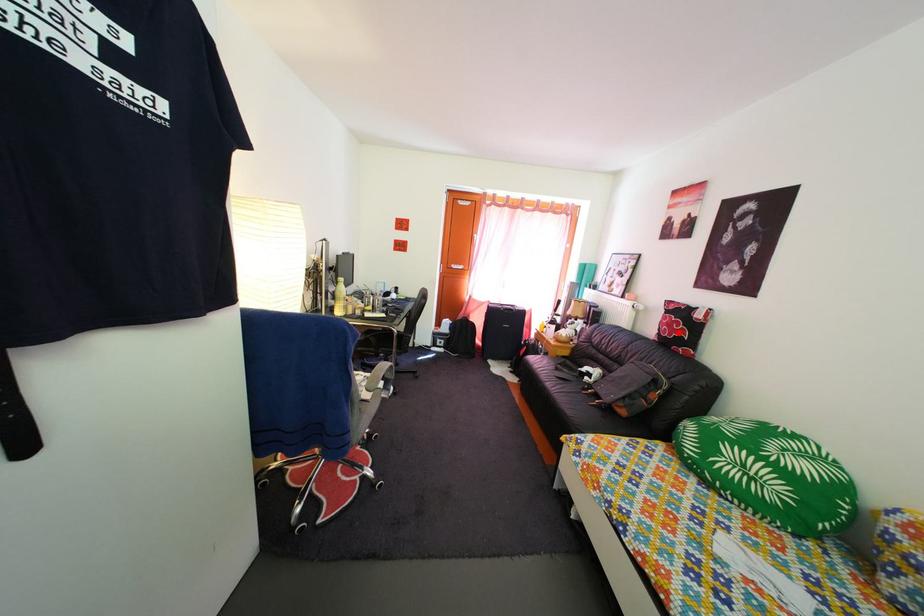
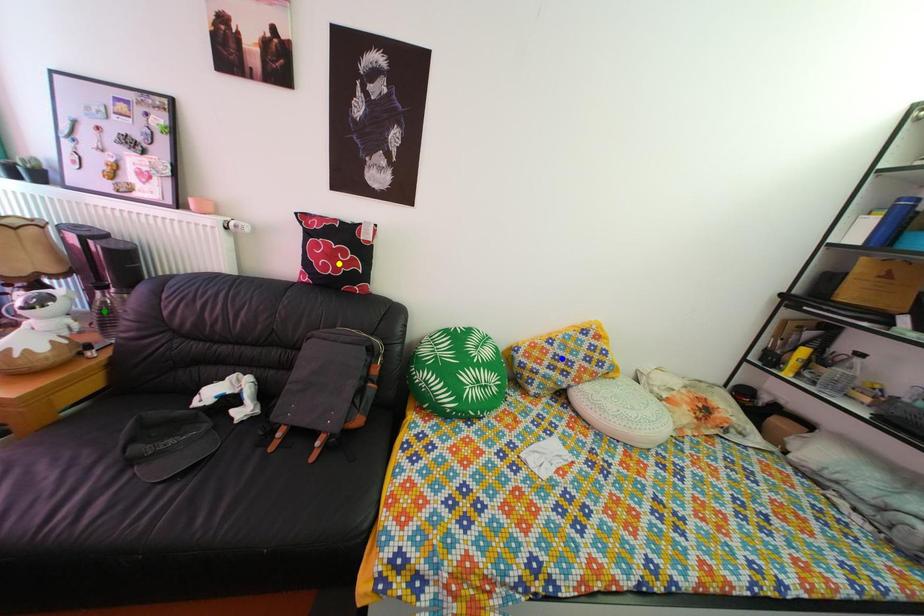
Question: I am providing you with two images of the same scene from different viewpoints. A red point is marked on the first image. You are given multiple points on the second image. Which spot in image 2 lines up with the point in image 1?

Choices:
 (A) yellow point
 (B) blue point
 (C) green point

Answer: (A)